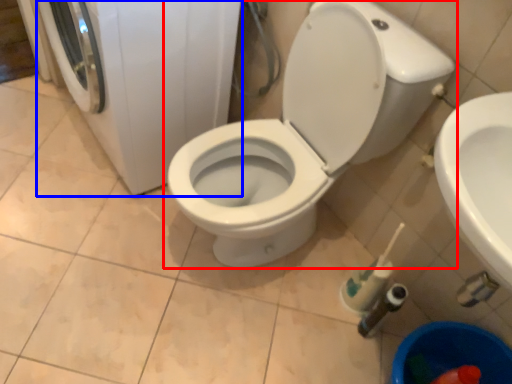
Question: Which point is closer to the camera, toilet (highlighted by a red box) or washing machine (highlighted by a blue box)?

Choices:
 (A) toilet
 (B) washing machine

Answer: (A)